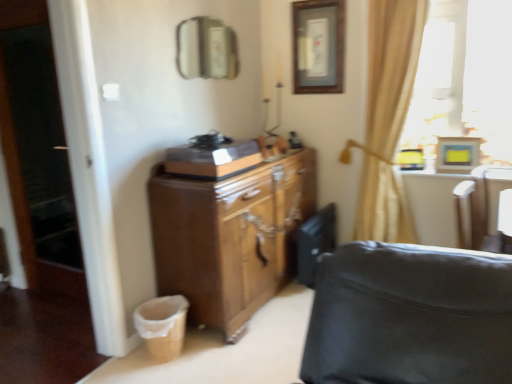
Question: Considering their positions, is wooden picture frame at upper right, which ranks as the 2th picture frame in back-to-front order, located in front of or behind wooden picture frame at upper center, acting as the second picture frame starting from the right?

Choices:
 (A) behind
 (B) front

Answer: (B)

Question: Do you think wooden picture frame at upper right, the 1th picture frame from the bottom, is within wooden picture frame at upper center, the first picture frame from the top, or outside of it?

Choices:
 (A) inside
 (B) outside

Answer: (B)

Question: Which of these objects is positioned farthest from the beige fabric curtain at upper right?

Choices:
 (A) beige fabric laundry basket at lower left
 (B) metallic rectangular mirror at upper center
 (C) brown wood cabinet at center
 (D) wooden picture frame at upper center, marked as the 1th picture frame in a back-to-front arrangement
 (E) transparent glass screen door at left

Answer: (E)

Question: Which object is the farthest from the beige fabric laundry basket at lower left?

Choices:
 (A) beige fabric curtain at upper right
 (B) transparent glass screen door at left
 (C) metallic rectangular mirror at upper center
 (D) wooden picture frame at upper center, the first picture frame from the top
 (E) brown wood cabinet at center

Answer: (C)